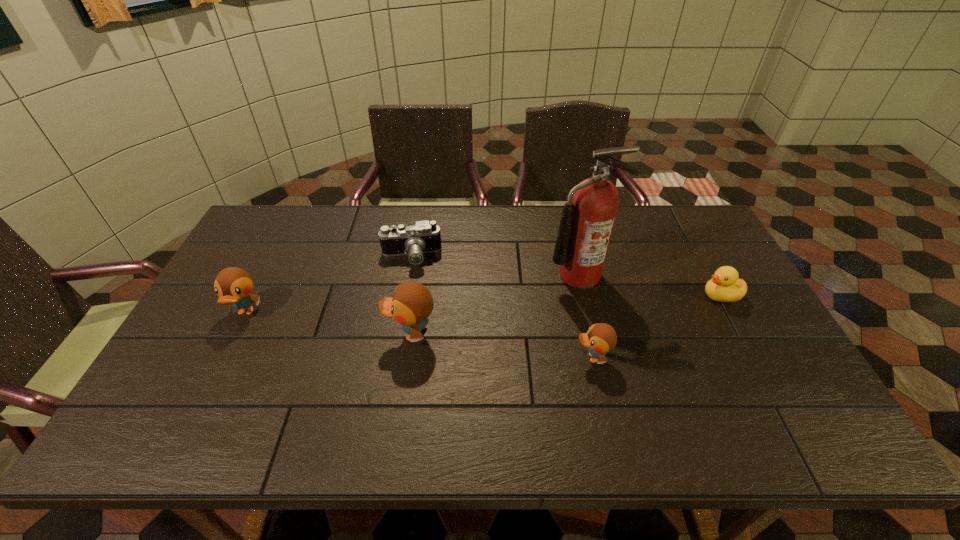
Image resolution: width=960 pixels, height=540 pixels. Identify the location of the second tallest duck. click(x=233, y=285).

Identify the location of the leftmost duck. This screenshot has height=540, width=960. (233, 285).

Find the location of a particular element. The height and width of the screenshot is (540, 960). the fifth shortest object is located at coordinates (411, 304).

I want to click on the tallest duck, so click(x=411, y=304).

Where is `the second duck from right to left`? the second duck from right to left is located at coordinates (600, 338).

This screenshot has width=960, height=540. Find the location of `the tallest object`. the tallest object is located at coordinates (587, 221).

The width and height of the screenshot is (960, 540). In order to click on camera in this screenshot , I will do `click(414, 239)`.

Identify the location of the rightmost object. (724, 286).

Identify the location of blank space located on the front-facing side of the second tallest duck. (200, 403).

Identify the location of vacant space situated 0.230m on the front-facing side of the third duck from right to left. The height and width of the screenshot is (540, 960). (300, 334).